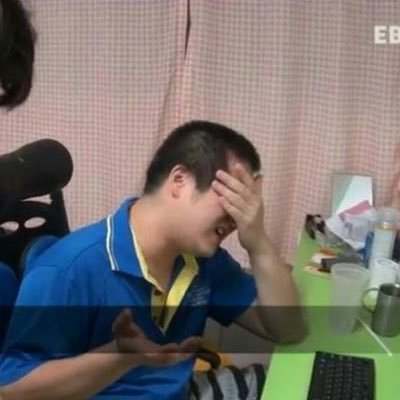
You are a GUI agent. You are given a task and a screenshot of the screen. Output one action in this format:
    pyautogui.click(x=<x>, y=<y>)
    Task: Click on the keyboard
    
    Given the screenshot: What is the action you would take?
    pyautogui.click(x=348, y=380)